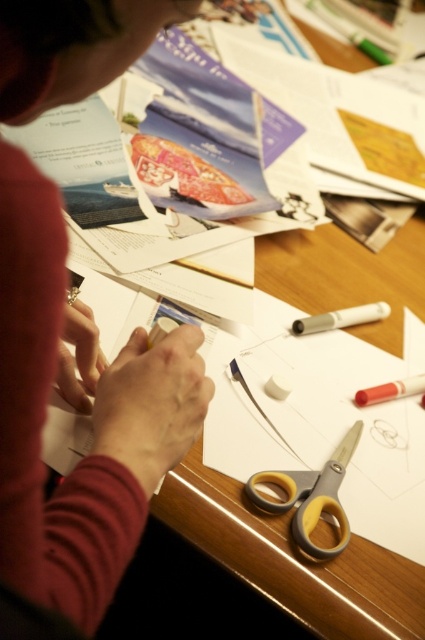
Consider the image. You are organizing a crafting kit and need to place the matte red sweater at upper left and the yellow rubberized scissors at center into a storage box. The box has a height limit of 20 cm. Can both items fit vertically without exceeding the height limit?

The matte red sweater at upper left is much taller than the yellow rubberized scissors at center. Since the sweater is taller, it might exceed the 20 cm height limit. The scissors alone would fit, but the sweater may not. Check the sweater height before placing both.